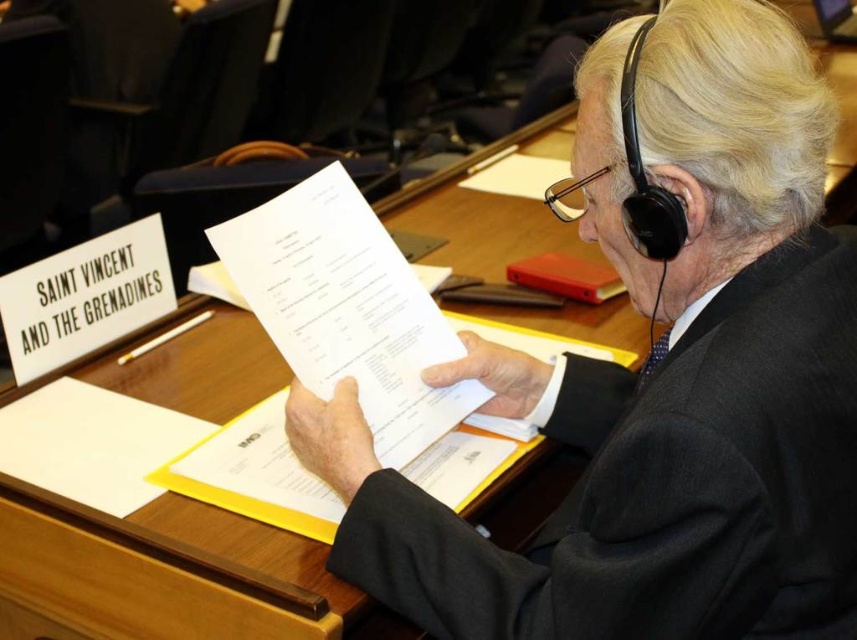
You are a photographer positioned to the left of the scene. You need to capture a clear shot of the black matte suit at center and the wooden table at center. Which object should you adjust your camera angle to focus on first to ensure both are in frame?

The black matte suit at center is to the right of wooden table at center, so you should first focus on the wooden table at center to ensure both objects are within the camera frame.

You are an event organizer arranging seating for a diplomatic meeting. You need to ensure that the black matte suit at center is positioned so it does not block the view of the white paper at center. Based on the current setup, is this requirement being met?

The black matte suit at center is in front of white paper at center, so it is blocking the view of the white paper at center. Adjust the position to ensure the black matte suit at center is behind or to the side of the white paper at center for visibility.

You are an event organizer setting up a conference table. You have a wooden table at center and a white paper at center. Where should you place the nameplate so that it is visible to attendees from the front of the table?

The nameplate should be placed on the white paper at center since the wooden table at center is in front of it, making the white paper more visible from the front.